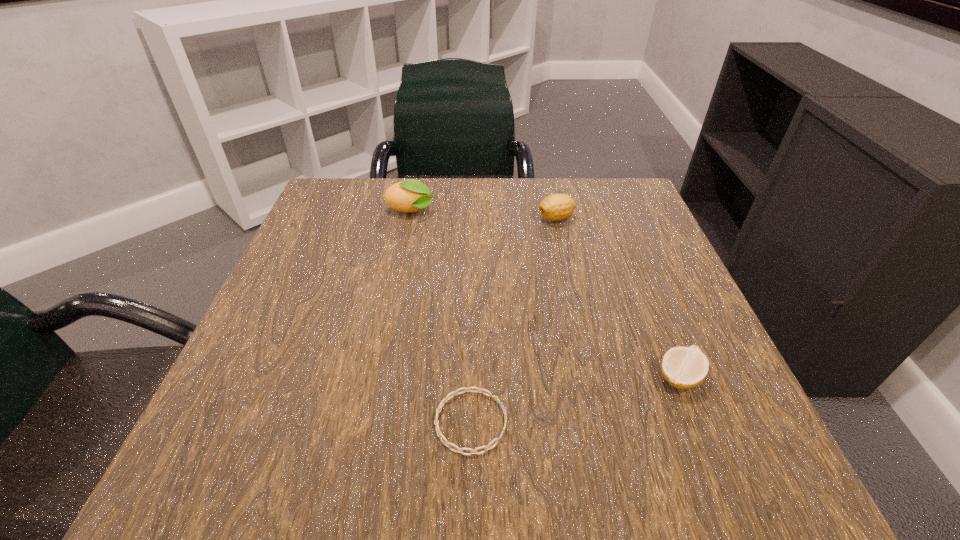
Image resolution: width=960 pixels, height=540 pixels. I want to click on vacant area at the left edge of the desktop, so click(337, 260).

The width and height of the screenshot is (960, 540). What are the coordinates of `vacant space at the right edge` in the screenshot? It's located at (641, 378).

This screenshot has height=540, width=960. I want to click on vacant area at the far left corner of the desktop, so click(373, 233).

This screenshot has height=540, width=960. In the image, there is a desktop. In order to click on vacant area at the far right corner in this screenshot , I will do `click(636, 193)`.

Find the location of a particular element. Image resolution: width=960 pixels, height=540 pixels. free spot between the second lemon from right to left and the leftmost object is located at coordinates (484, 215).

In order to click on vacant space that's between the tallest object and the rightmost object in this screenshot , I will do `click(545, 294)`.

Where is `vacant point located between the bracelet and the tallest lemon`? Image resolution: width=960 pixels, height=540 pixels. vacant point located between the bracelet and the tallest lemon is located at coordinates (441, 316).

Identify the location of free space between the nearest lemon and the tallest lemon. (545, 294).

Locate an element on the screen. free space between the second tallest object and the third tallest object is located at coordinates (617, 298).

Identify the location of blank region between the leftmost lemon and the bracelet. The height and width of the screenshot is (540, 960). (441, 316).